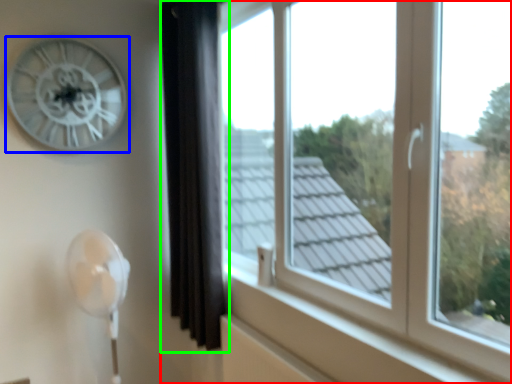
Question: Estimate the real-world distances between objects in this image. Which object is farther from window (highlighted by a red box), wall clock (highlighted by a blue box) or curtain (highlighted by a green box)?

Choices:
 (A) wall clock
 (B) curtain

Answer: (A)